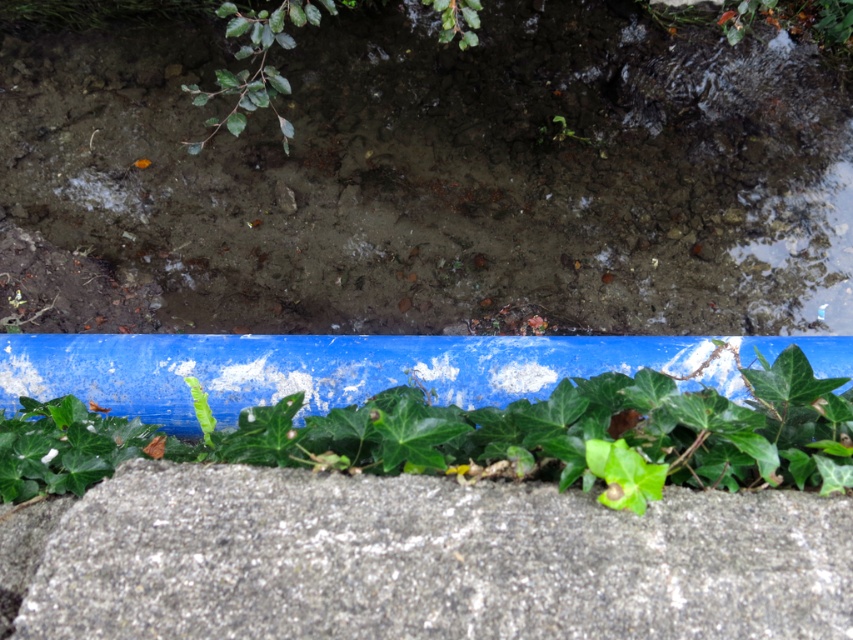
You are a maintenance worker needing to inspect both the translucent mud puddle at upper center and the green leafy plant at bottom. Given that your ladder is 2 meters long, can you safely reach both objects from your current position?

The translucent mud puddle at upper center is 2.04 meters away from the green leafy plant at bottom. Since the ladder is only 2 meters long, it is slightly shorter than the distance between them, making it difficult to safely reach both without moving the ladder.

You are standing in front of the concrete surface with the blue pipe and green ivy. There is a specific point marked at coordinates point (61, 612). If you want to reach this point without moving your feet, can you touch it with your outstretched hand?

The point (61, 612) is 32.48 inches from the viewer. Since the average human arm length is about 25 to 30 inches, you would not be able to reach it with your outstretched hand without moving your feet.

You are a photographer aiming to capture the gray rough concrete at bottom and the translucent mud puddle at upper center in a single shot. Which object will appear closer to the camera in the photo?

The translucent mud puddle at upper center will appear closer to the camera because it is further to the viewer than the gray rough concrete at bottom.